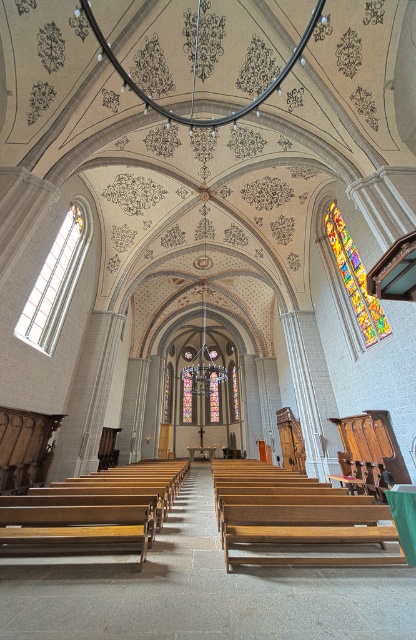
Question: Which is nearer to the wooden bench at center?

Choices:
 (A) multicolored stained glass at upper right
 (B) clear glass window at left

Answer: (B)

Question: Estimate the real-world distances between objects in this image. Which object is closer to the wooden bench at center?

Choices:
 (A) clear glass window at left
 (B) wooden church bench at center

Answer: (B)

Question: Which point is farther to the camera?

Choices:
 (A) wooden church bench at center
 (B) clear glass window at left
 (C) wooden bench at center

Answer: (B)

Question: Is clear glass window at left to the left of multicolored stained glass at upper right from the viewer's perspective?

Choices:
 (A) yes
 (B) no

Answer: (A)

Question: Can you confirm if wooden church bench at center is smaller than wooden bench at center?

Choices:
 (A) no
 (B) yes

Answer: (B)

Question: Is wooden bench at center smaller than clear glass window at left?

Choices:
 (A) no
 (B) yes

Answer: (A)